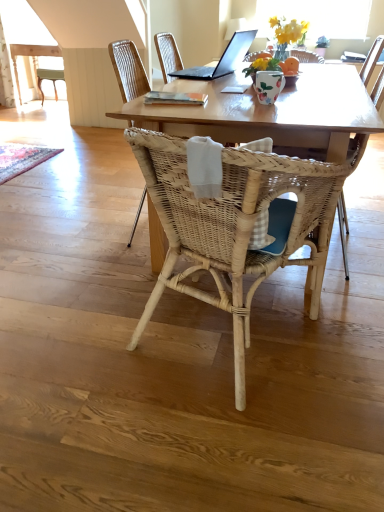
This screenshot has height=512, width=384. I want to click on free region on the left part of woven wood chair at center, which is counted as the second chair, starting from the front, so click(91, 229).